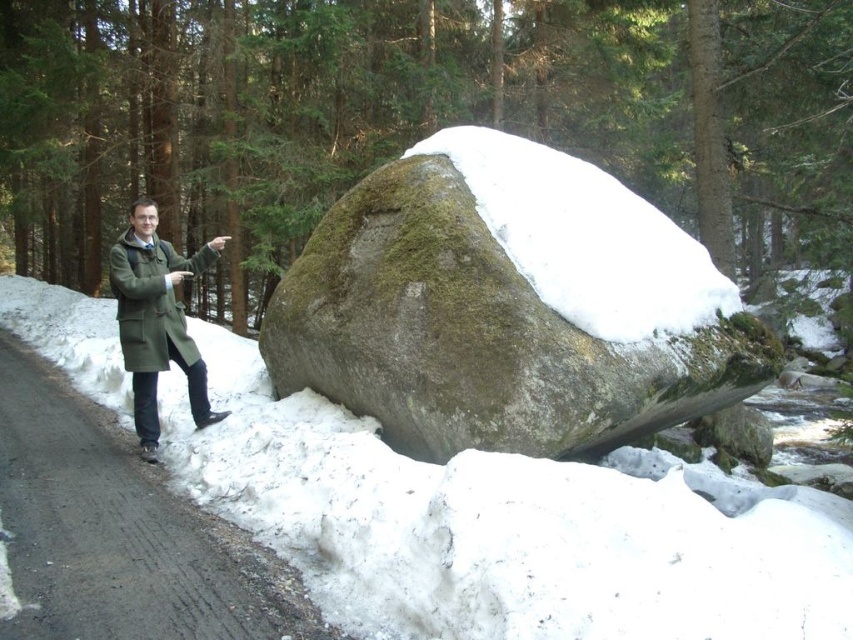
You are standing on the cleared path and want to take a photo of the large boulder. Where should you position yourself to ensure the white fluffy snow at center is visible in the frame?

You should position yourself on the cleared path to the left of the large boulder so that the white fluffy snow at center is visible in the frame.

You are standing at the center of the image and want to move towards the green mossy rock at center. Which direction should you move?

Since the green mossy rock at center is located at point (509, 307), which is very close to the center coordinates, you should move slightly towards the center to reach it.

You are planning to place a small decorative snowman between the white fluffy snow at center and the green mossy rock at center. Given that the snowman requires a space of 4 feet in diameter, will there be enough space between them to accommodate it?

The distance between the white fluffy snow at center and the green mossy rock at center is 4.48 feet. Since the snowman needs 4 feet of space, there is enough space to place it between them.